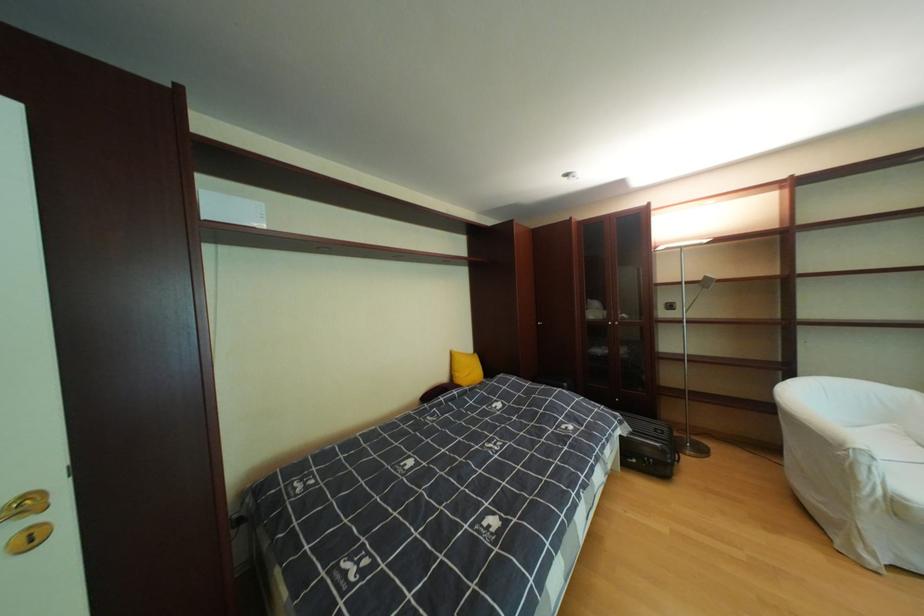
Describe the element at coordinates (29, 538) in the screenshot. I see `the silver cabinet knob` at that location.